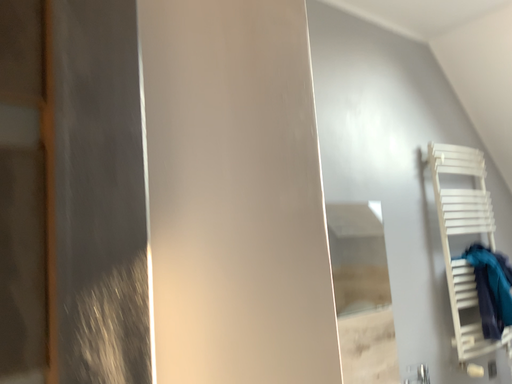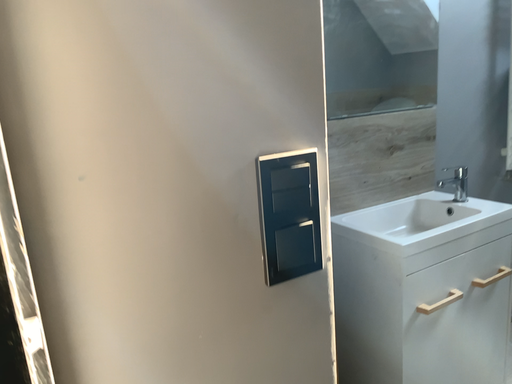
Question: How did the camera likely rotate when shooting the video?

Choices:
 (A) rotated downward
 (B) rotated upward

Answer: (A)